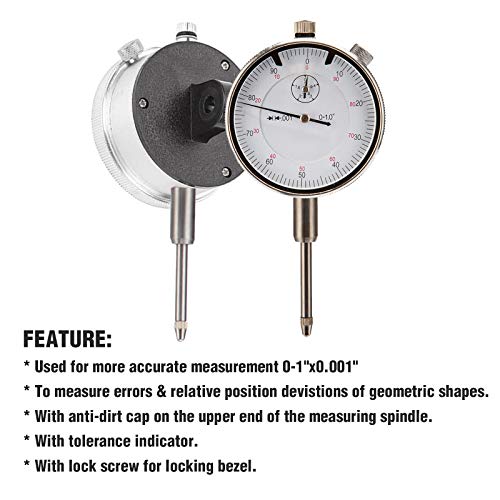
The width and height of the screenshot is (500, 500). I want to click on screws, so [227, 171], [145, 104], [224, 65].